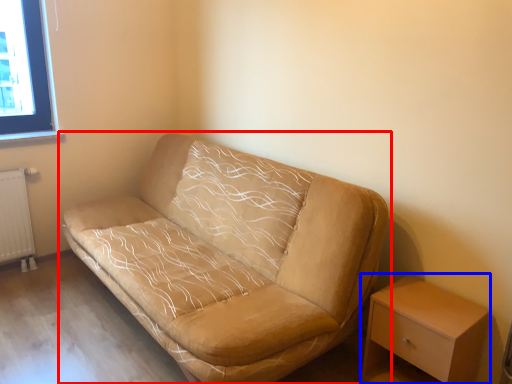
Question: Which object appears farthest to the camera in this image, studio couch (highlighted by a red box) or table (highlighted by a blue box)?

Choices:
 (A) studio couch
 (B) table

Answer: (B)